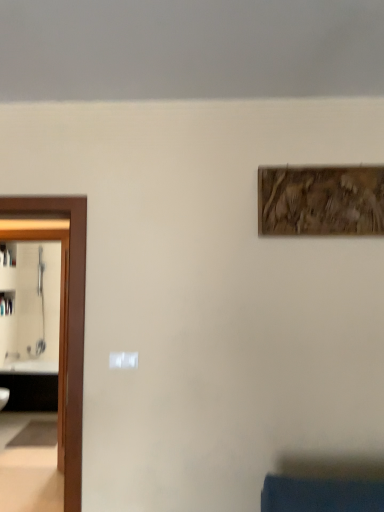
Question: Should I look upward or downward to see wooden textured artwork at upper right?

Choices:
 (A) up
 (B) down

Answer: (A)

Question: Can you confirm if white glossy sink at left is thinner than wooden textured artwork at upper right?

Choices:
 (A) no
 (B) yes

Answer: (A)

Question: From the image's perspective, is white glossy sink at left on top of wooden textured artwork at upper right?

Choices:
 (A) yes
 (B) no

Answer: (B)

Question: Is white glossy sink at left beside wooden textured artwork at upper right?

Choices:
 (A) no
 (B) yes

Answer: (A)

Question: Is white glossy sink at left far away from wooden textured artwork at upper right?

Choices:
 (A) yes
 (B) no

Answer: (A)

Question: Is white glossy sink at left wider than wooden textured artwork at upper right?

Choices:
 (A) no
 (B) yes

Answer: (B)

Question: Is white glossy sink at left located outside wooden textured artwork at upper right?

Choices:
 (A) yes
 (B) no

Answer: (A)

Question: Is wooden textured artwork at upper right turned away from white glossy sink at left?

Choices:
 (A) yes
 (B) no

Answer: (B)

Question: Considering the relative sizes of wooden textured artwork at upper right and white glossy sink at left in the image provided, is wooden textured artwork at upper right shorter than white glossy sink at left?

Choices:
 (A) yes
 (B) no

Answer: (A)

Question: From the image's perspective, does wooden textured artwork at upper right appear lower than white glossy sink at left?

Choices:
 (A) no
 (B) yes

Answer: (A)

Question: Is white glossy sink at left completely or partially inside wooden textured artwork at upper right?

Choices:
 (A) yes
 (B) no

Answer: (B)

Question: Considering the relative positions of wooden textured artwork at upper right and white glossy sink at left in the image provided, is wooden textured artwork at upper right to the right of white glossy sink at left from the viewer's perspective?

Choices:
 (A) no
 (B) yes

Answer: (B)

Question: From the image's perspective, is wooden textured artwork at upper right above white glossy sink at left?

Choices:
 (A) no
 (B) yes

Answer: (B)

Question: From a real-world perspective, is brown wooden door at left physically above wooden textured artwork at upper right?

Choices:
 (A) no
 (B) yes

Answer: (A)